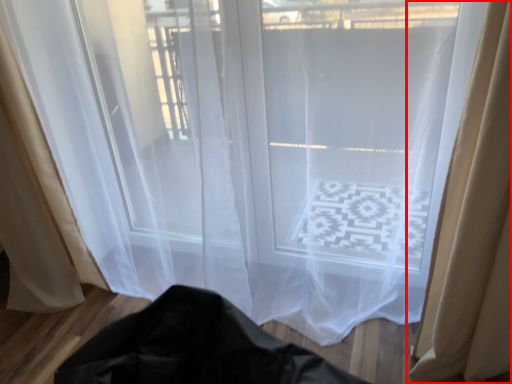
Question: From the image's perspective, where is curtain (annotated by the red box) located relative to curtain?

Choices:
 (A) below
 (B) above

Answer: (A)